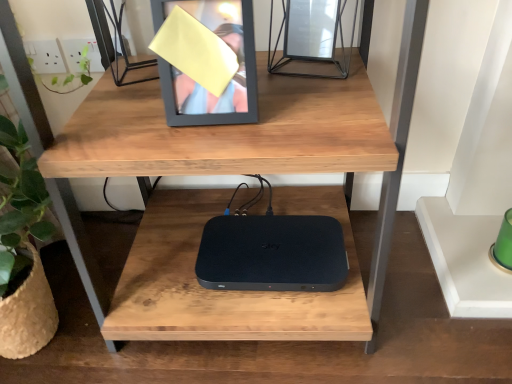
Question: Considering the positions of point (162, 62) and point (236, 218), is point (162, 62) closer or farther from the camera than point (236, 218)?

Choices:
 (A) closer
 (B) farther

Answer: (A)

Question: From the image's perspective, relative to black matte/solid sky box at center, is matte black picture frame at upper center above or below?

Choices:
 (A) below
 (B) above

Answer: (B)

Question: In the image, is matte black picture frame at upper center on the left side or the right side of black matte/solid sky box at center?

Choices:
 (A) left
 (B) right

Answer: (A)

Question: Considering the positions of point (321, 286) and point (249, 41), is point (321, 286) closer or farther from the camera than point (249, 41)?

Choices:
 (A) farther
 (B) closer

Answer: (A)

Question: In terms of width, does black matte/solid sky box at center look wider or thinner when compared to matte black picture frame at upper center?

Choices:
 (A) thin
 (B) wide

Answer: (B)

Question: Would you say black matte/solid sky box at center is inside or outside matte black picture frame at upper center?

Choices:
 (A) inside
 (B) outside

Answer: (B)

Question: Considering the positions of black matte/solid sky box at center and matte black picture frame at upper center in the image, is black matte/solid sky box at center taller or shorter than matte black picture frame at upper center?

Choices:
 (A) tall
 (B) short

Answer: (B)